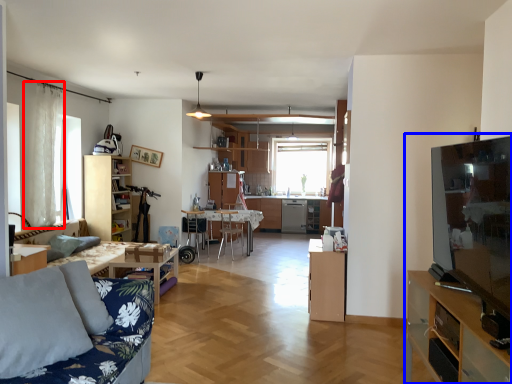
Question: Which of the following is the farthest to the observer, curtain (highlighted by a red box) or entertainment center (highlighted by a blue box)?

Choices:
 (A) curtain
 (B) entertainment center

Answer: (A)